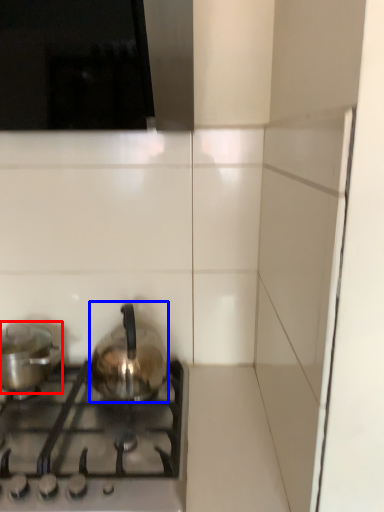
Question: Which of the following is the closest to the observer, kitchen appliance (highlighted by a red box) or kitchen appliance (highlighted by a blue box)?

Choices:
 (A) kitchen appliance
 (B) kitchen appliance

Answer: (B)